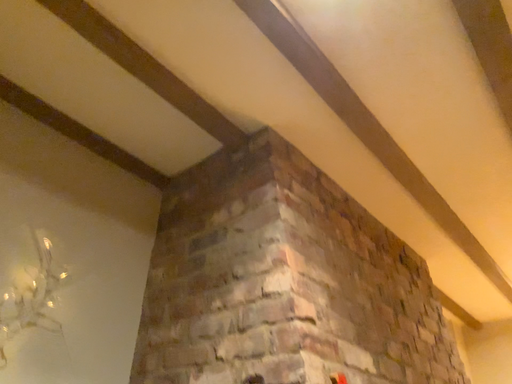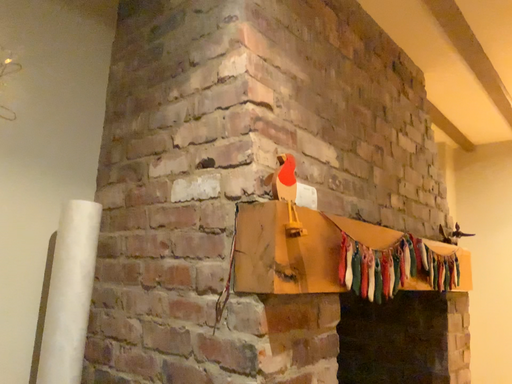
Question: How did the camera likely rotate when shooting the video?

Choices:
 (A) rotated upward
 (B) rotated downward

Answer: (B)